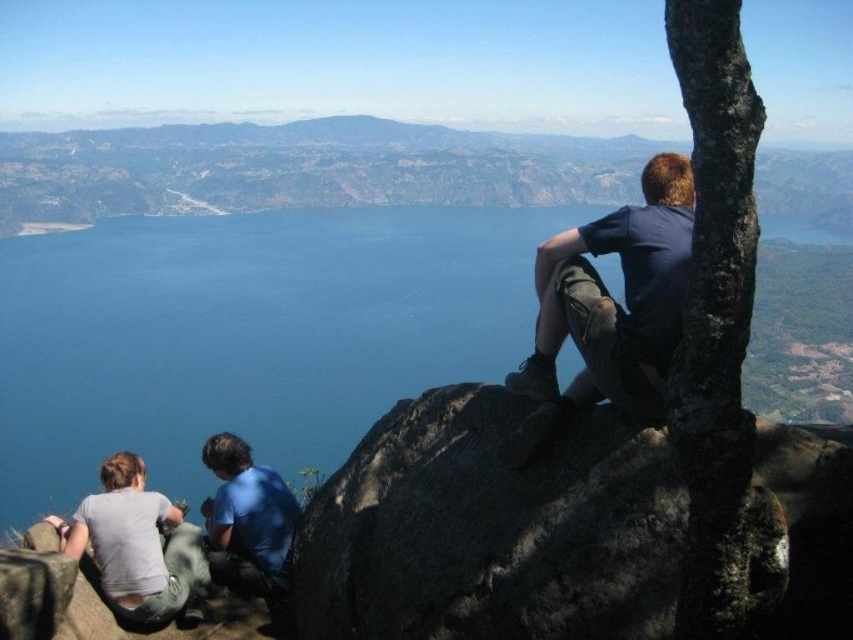
You are a photographer trying to capture a group shot of the dark blue shirt at upper right and the blue matte shirt at lower left. Which person should you position to your right side to frame them properly?

The dark blue shirt at upper right should be positioned to your right side because it is already on the right side of the blue matte shirt at lower left.

You are standing at the center of the image and want to reach the dark gray rock at upper right. Which direction should you move to reach it?

You should move towards the upper right direction to reach the dark gray rock at upper right as it is located at point (492, 529).

You are planning to place a small picnic basket between the dark gray rock at upper right and the light gray cotton shirt at lower left. Considering their sizes, which object will have more space around it after placing the basket?

The dark gray rock at upper right has a larger size compared to the light gray cotton shirt at lower left, so after placing the picnic basket, the dark gray rock at upper right will have more space around it.